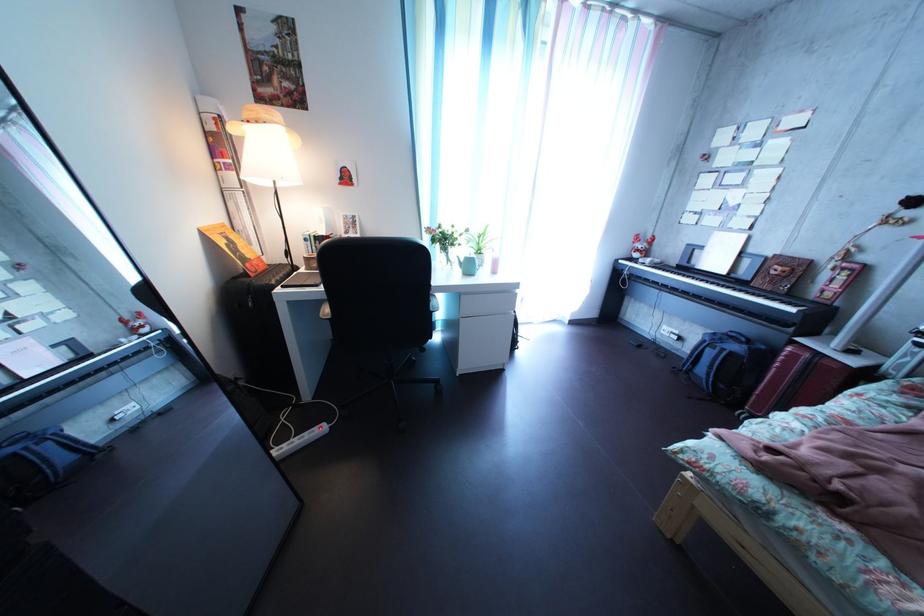
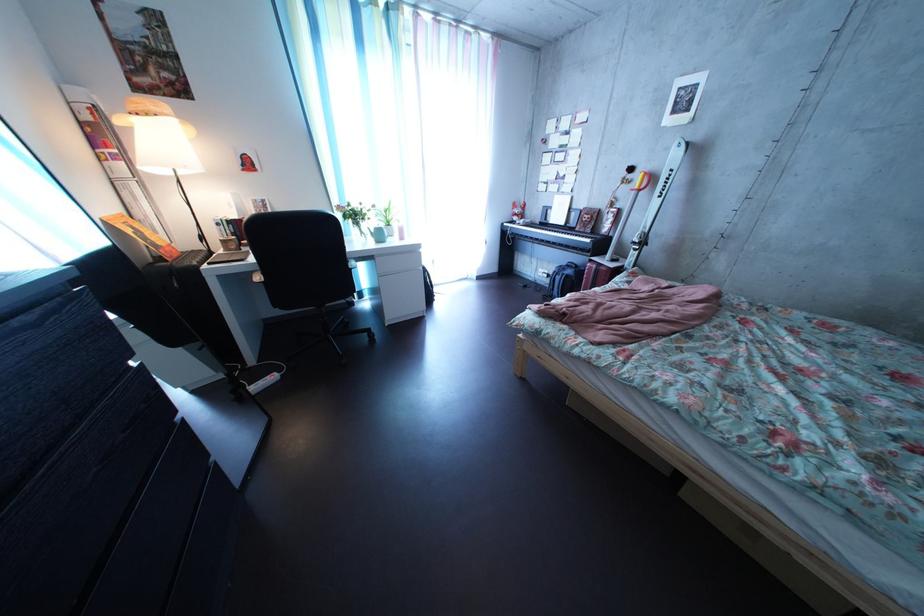
Where in the second image is the point corresponding to (237,251) from the first image?

(142, 238)